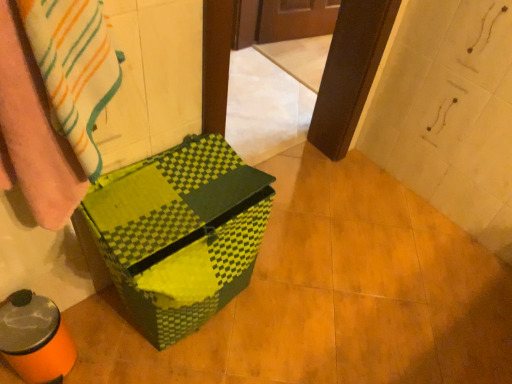
You are a GUI agent. You are given a task and a screenshot of the screen. Output one action in this format:
    pyautogui.click(x=<x>, y=<y>)
    Task: Click on the empty space that is to the right of green checkered cardboard box at center
    
    Given the screenshot: What is the action you would take?
    pyautogui.click(x=290, y=308)